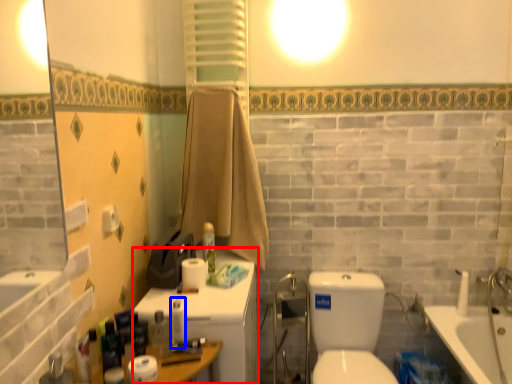
Question: Which point is closer to the camera, medicine cabinet (highlighted by a red box) or toiletry (highlighted by a blue box)?

Choices:
 (A) medicine cabinet
 (B) toiletry

Answer: (B)